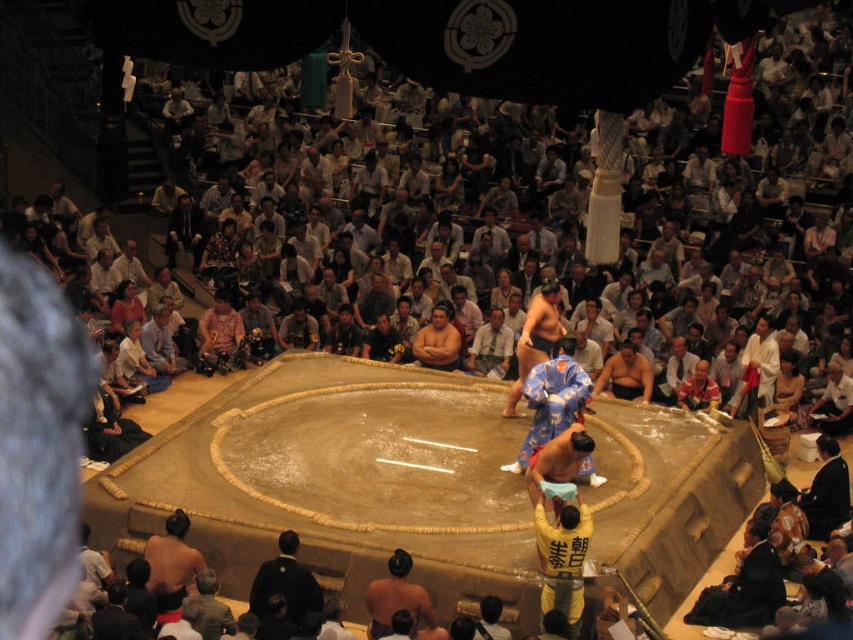
Question: Is brown textured kimono at center bigger than light blue fabric shirt at center?

Choices:
 (A) yes
 (B) no

Answer: (A)

Question: Can you confirm if blue silk kimono at center is positioned to the right of black silk kimono at lower right?

Choices:
 (A) no
 (B) yes

Answer: (A)

Question: Which point is farther to the camera?

Choices:
 (A) blue silk kimono at center
 (B) brown textured kimono at center
 (C) black silk kimono at center

Answer: (A)

Question: Which point is closer to the camera?

Choices:
 (A) black silk kimono at center
 (B) fat man at center
 (C) blue silk kimono at center
 (D) black silk kimono at lower right

Answer: (A)

Question: Is brown skin sumo at lower left smaller than light blue fabric shirt at center?

Choices:
 (A) yes
 (B) no

Answer: (B)

Question: Which object is closer to the camera taking this photo?

Choices:
 (A) brown skin sumo at lower left
 (B) light blue fabric shirt at center
 (C) brown textured kimono at center

Answer: (C)